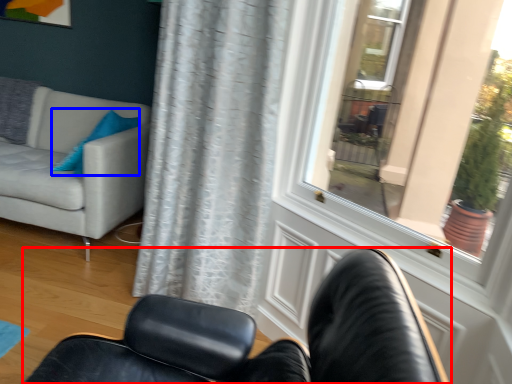
Question: Which point is further to the camera, chair (highlighted by a red box) or pillow (highlighted by a blue box)?

Choices:
 (A) chair
 (B) pillow

Answer: (B)